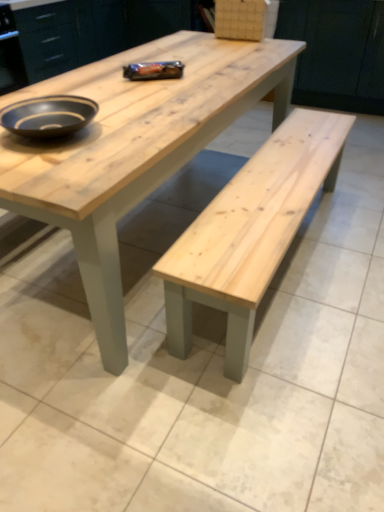
Question: Which is correct: natural wood bench at center is inside natural wood cabinet at upper center, marked as the 1th cabinetry in a left-to-right arrangement, or outside of it?

Choices:
 (A) outside
 (B) inside

Answer: (A)

Question: Looking at their shapes, would you say natural wood bench at center is wider or thinner than natural wood cabinet at upper center, marked as the 1th cabinetry in a left-to-right arrangement?

Choices:
 (A) wide
 (B) thin

Answer: (A)

Question: Based on their relative distances, which object is farther from the natural wood bench at center?

Choices:
 (A) matte wood cabinet at upper center, the first cabinetry when ordered from right to left
 (B) matte black bowl at upper left
 (C) natural wood cabinet at upper center, marked as the 1th cabinetry in a left-to-right arrangement

Answer: (C)

Question: Which object is positioned farthest from the natural wood bench at center?

Choices:
 (A) natural wood cabinet at upper center, marked as the 1th cabinetry in a left-to-right arrangement
 (B) matte black bowl at upper left
 (C) matte wood cabinet at upper center, which ranks as the second cabinetry in left-to-right order

Answer: (A)